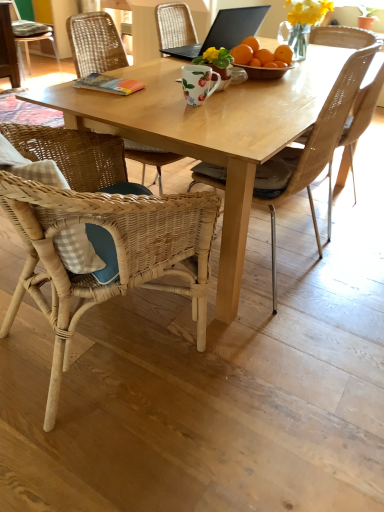
Question: Does woven wicker chair at lower left, which ranks as the 1th chair in front-to-back order, turn towards woven wood chair at center, acting as the 2th chair starting from the right?

Choices:
 (A) no
 (B) yes

Answer: (B)

Question: Is woven wicker chair at lower left, which ranks as the 1th chair in front-to-back order, with woven wood chair at center, acting as the 2th chair starting from the right?

Choices:
 (A) yes
 (B) no

Answer: (B)

Question: Is woven wicker chair at lower left, arranged as the third chair when viewed from the right, turned away from woven wood chair at center, acting as the 2th chair starting from the right?

Choices:
 (A) no
 (B) yes

Answer: (A)

Question: Considering the relative positions of woven wicker chair at lower left, the 2th chair when ordered from left to right, and woven wood chair at center, which appears as the 3th chair when viewed from the back, in the image provided, is woven wicker chair at lower left, the 2th chair when ordered from left to right, to the right of woven wood chair at center, which appears as the 3th chair when viewed from the back, from the viewer's perspective?

Choices:
 (A) no
 (B) yes

Answer: (A)

Question: From a real-world perspective, is woven wicker chair at lower left, the 2th chair when ordered from left to right, beneath woven wood chair at center, acting as the 2th chair starting from the right?

Choices:
 (A) yes
 (B) no

Answer: (A)

Question: Considering the relative positions of woven wicker chair at lower left, arranged as the third chair when viewed from the right, and woven wood chair at center, which appears as the 3th chair when viewed from the back, in the image provided, is woven wicker chair at lower left, arranged as the third chair when viewed from the right, behind woven wood chair at center, which appears as the 3th chair when viewed from the back,?

Choices:
 (A) yes
 (B) no

Answer: (B)

Question: From a real-world perspective, does woven wicker chair at lower left, arranged as the third chair when viewed from the right, stand above floral matte coffee cup at center?

Choices:
 (A) yes
 (B) no

Answer: (B)

Question: Could floral matte coffee cup at center be considered to be inside woven wicker chair at lower left, the 4th chair when ordered from back to front?

Choices:
 (A) yes
 (B) no

Answer: (B)

Question: Is woven wicker chair at lower left, which ranks as the 1th chair in front-to-back order, smaller than floral matte coffee cup at center?

Choices:
 (A) no
 (B) yes

Answer: (A)

Question: From the image's perspective, is woven wicker chair at lower left, the 4th chair when ordered from back to front, beneath floral matte coffee cup at center?

Choices:
 (A) no
 (B) yes

Answer: (B)

Question: Considering the relative sizes of woven wicker chair at lower left, the 4th chair when ordered from back to front, and floral matte coffee cup at center in the image provided, is woven wicker chair at lower left, the 4th chair when ordered from back to front, wider than floral matte coffee cup at center?

Choices:
 (A) yes
 (B) no

Answer: (A)

Question: Is woven wicker chair at lower left, which ranks as the 1th chair in front-to-back order, facing away from floral matte coffee cup at center?

Choices:
 (A) yes
 (B) no

Answer: (B)

Question: Is woven wood chair at upper left, which is the fourth chair from front to back, to the right of black matte laptop at upper center from the viewer's perspective?

Choices:
 (A) yes
 (B) no

Answer: (B)